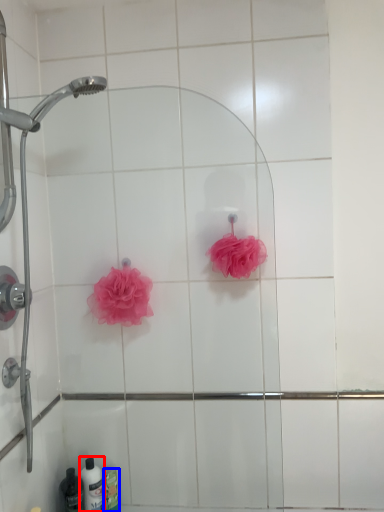
Question: Among these objects, which one is farthest to the camera, toiletry (highlighted by a red box) or toiletry (highlighted by a blue box)?

Choices:
 (A) toiletry
 (B) toiletry

Answer: (B)